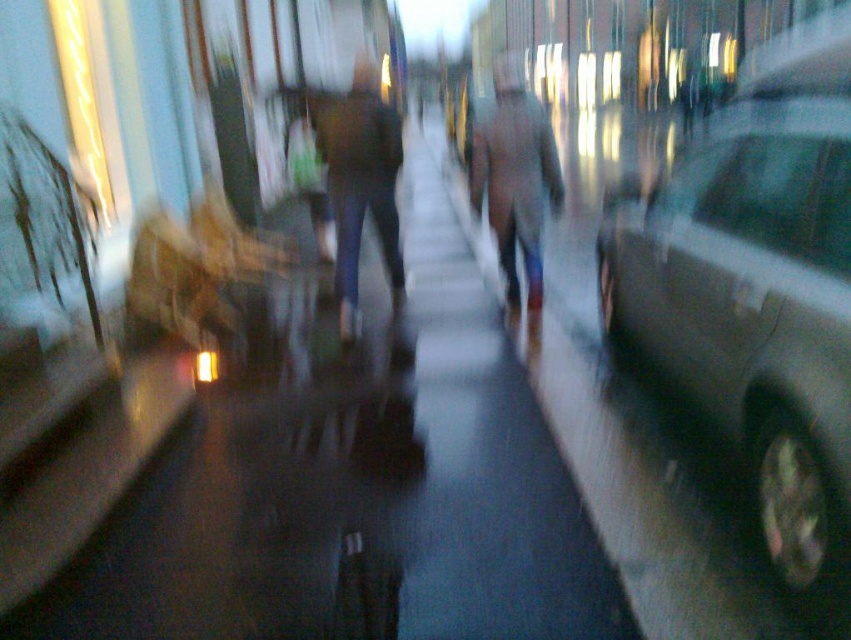
Does point (718, 422) come behind point (350, 324)?

No.

Is metallic silver car at right below dark blue jeans at center?

Correct, metallic silver car at right is located below dark blue jeans at center.

Where is `metallic silver car at right`? metallic silver car at right is located at coordinates (757, 289).

Which is more to the left, dark asphalt sidewalk at center or metallic silver car at right?

Positioned to the left is dark asphalt sidewalk at center.

Who is lower down, dark asphalt sidewalk at center or metallic silver car at right?

dark asphalt sidewalk at center

Describe the element at coordinates (353, 481) in the screenshot. I see `dark asphalt sidewalk at center` at that location.

Where is `dark asphalt sidewalk at center`? Image resolution: width=851 pixels, height=640 pixels. dark asphalt sidewalk at center is located at coordinates [353, 481].

Which is more to the left, dark blue jeans at center or gray wool coat at center?

From the viewer's perspective, dark blue jeans at center appears more on the left side.

Can you confirm if dark blue jeans at center is wider than gray wool coat at center?

Incorrect, dark blue jeans at center's width does not surpass gray wool coat at center's.

Does point (367, 104) lie behind point (512, 225)?

No, it is in front of (512, 225).

Locate an element on the screen. This screenshot has width=851, height=640. dark blue jeans at center is located at coordinates (x=360, y=180).